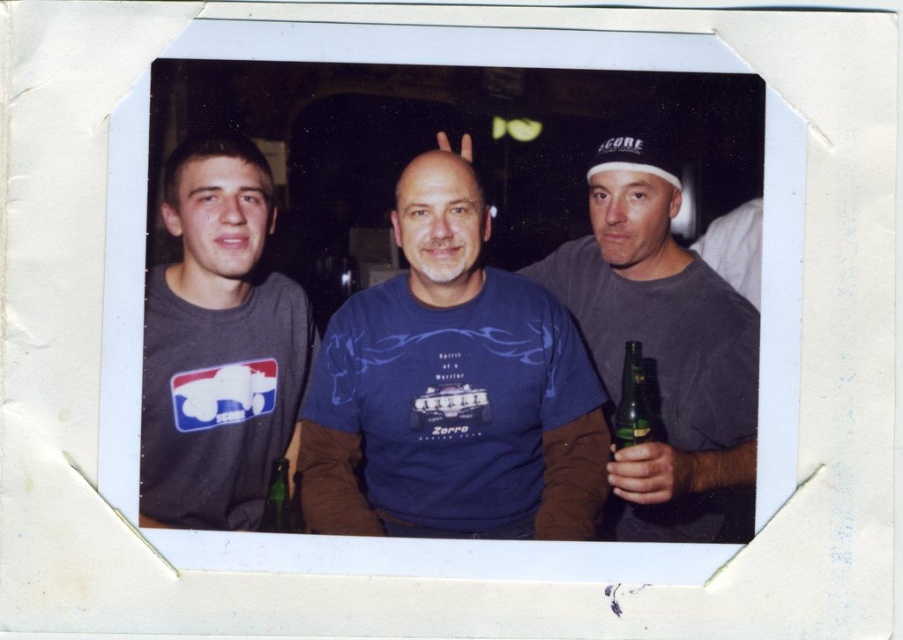
Does matte gray t-shirt at left appear under green glass bottle at right?

No.

Identify the location of matte gray t-shirt at left. (219, 344).

The height and width of the screenshot is (640, 903). Describe the element at coordinates (632, 401) in the screenshot. I see `green glass bottle at right` at that location.

From the picture: Does green glass bottle at right have a lesser width compared to green glass bottle at center?

No.

Who is more distant from viewer, (632,364) or (271,508)?

Point (632,364)

I want to click on green glass bottle at right, so click(632, 401).

At what (x,y) coordinates should I click in order to perform the action: click on white matte baseball cap at center right. Please return your answer as a coordinate pair (x, y). This screenshot has height=640, width=903. Looking at the image, I should click on (638, 154).

Is the position of white matte baseball cap at center right less distant than that of green glass bottle at center?

That is False.

Who is more distant from viewer, [669,152] or [273,496]?

The point [669,152] is behind.

You are a GUI agent. You are given a task and a screenshot of the screen. Output one action in this format:
    pyautogui.click(x=<x>, y=<y>)
    Task: Click on the white matte baseball cap at center right
    Image resolution: width=903 pixels, height=640 pixels.
    Given the screenshot: What is the action you would take?
    pyautogui.click(x=638, y=154)